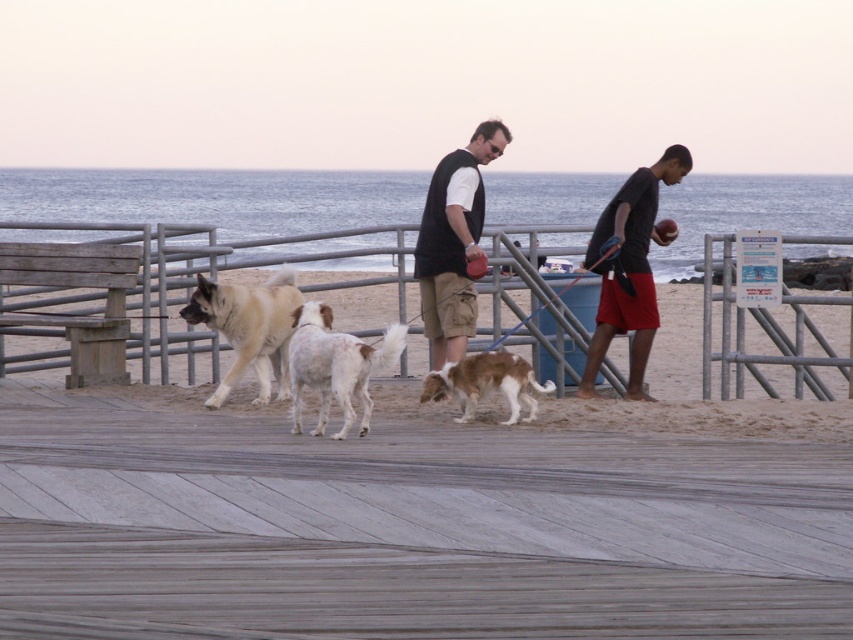
Question: Does brown fur dog at center have a smaller size compared to brown and white fur at center?

Choices:
 (A) no
 (B) yes

Answer: (A)

Question: Is black vest at center wider than black matte shirt at right?

Choices:
 (A) yes
 (B) no

Answer: (B)

Question: Which object is closer to the camera taking this photo?

Choices:
 (A) black vest at center
 (B) brown and white fur at center
 (C) white speckled fur dog at center

Answer: (C)

Question: Which is farther from the brown and white fur at center?

Choices:
 (A) brown fur dog at center
 (B) black matte shirt at right
 (C) black vest at center
 (D) white speckled fur dog at center

Answer: (B)

Question: Which point appears closest to the camera in this image?

Choices:
 (A) (389, 332)
 (B) (434, 253)
 (C) (535, 392)
 (D) (648, 189)

Answer: (A)

Question: Can you confirm if black vest at center is positioned below white speckled fur dog at center?

Choices:
 (A) no
 (B) yes

Answer: (A)